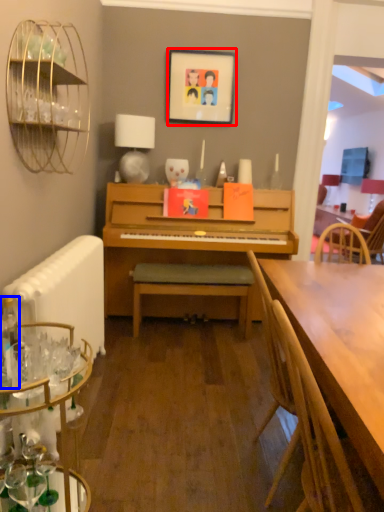
Question: Which object appears closest to the camera in this image, picture frame (highlighted by a red box) or bottle (highlighted by a blue box)?

Choices:
 (A) picture frame
 (B) bottle

Answer: (B)